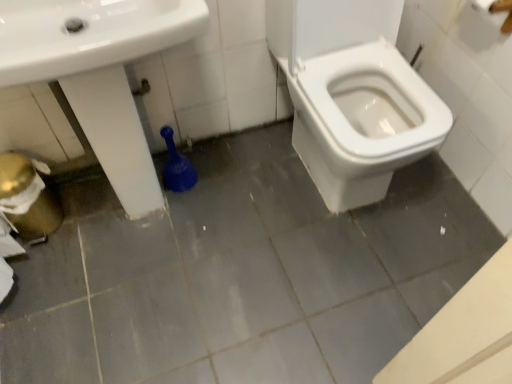
The image size is (512, 384). What do you see at coordinates (99, 73) in the screenshot?
I see `white glossy sink at lower left` at bounding box center [99, 73].

You are a GUI agent. You are given a task and a screenshot of the screen. Output one action in this format:
    pyautogui.click(x=<x>, y=<y>)
    Task: Click on the white glossy sink at lower left
    The width and height of the screenshot is (512, 384).
    Given the screenshot: What is the action you would take?
    pyautogui.click(x=99, y=73)

In order to face white glossy toilet at center, should I rotate leftwards or rightwards?

A 14.107 degree turn to the right will do.

What do you see at coordinates (352, 95) in the screenshot? I see `white glossy toilet at center` at bounding box center [352, 95].

You are a GUI agent. You are given a task and a screenshot of the screen. Output one action in this format:
    pyautogui.click(x=<x>, y=<y>)
    Task: Click on the white glossy toilet at center
    The width and height of the screenshot is (512, 384).
    Given the screenshot: What is the action you would take?
    click(x=352, y=95)

Locate an element on the screen. white glossy sink at lower left is located at coordinates (99, 73).

Which is more to the right, white glossy toilet at center or white glossy sink at lower left?

Positioned to the right is white glossy toilet at center.

In the scene shown: Considering the positions of objects white glossy toilet at center and white glossy sink at lower left in the image provided, who is behind, white glossy toilet at center or white glossy sink at lower left?

white glossy toilet at center is further from the camera.

Which point is more distant from viewer, (433, 129) or (150, 179)?

The point (150, 179) is farther from the camera.

From the image's perspective, which is above, white glossy toilet at center or white glossy sink at lower left?

From the image's view, white glossy toilet at center is above.

From a real-world perspective, is white glossy toilet at center physically located above or below white glossy sink at lower left?

From a real-world perspective, white glossy toilet at center is physically below white glossy sink at lower left.

Considering the relative sizes of white glossy toilet at center and white glossy sink at lower left in the image provided, is white glossy toilet at center wider than white glossy sink at lower left?

Yes, white glossy toilet at center is wider than white glossy sink at lower left.

Can you confirm if white glossy toilet at center is shorter than white glossy sink at lower left?

Yes, white glossy toilet at center is shorter than white glossy sink at lower left.

Looking at the image, does white glossy toilet at center seem bigger or smaller compared to white glossy sink at lower left?

Clearly, white glossy toilet at center is smaller in size than white glossy sink at lower left.

Choose the correct answer: Is white glossy toilet at center inside white glossy sink at lower left or outside it?

white glossy toilet at center is located beyond the bounds of white glossy sink at lower left.

Is white glossy toilet at center placed right next to white glossy sink at lower left?

No, white glossy toilet at center is not making contact with white glossy sink at lower left.

Is white glossy toilet at center oriented away from white glossy sink at lower left?

white glossy toilet at center is not turned away from white glossy sink at lower left.

The width and height of the screenshot is (512, 384). I want to click on sink in front of the white glossy toilet at center, so click(99, 73).

In the scene shown: Considering the positions of objects white glossy sink at lower left and white glossy toilet at center in the image provided, who is more to the left, white glossy sink at lower left or white glossy toilet at center?

white glossy sink at lower left is more to the left.

Which object is closer to the camera taking this photo, white glossy sink at lower left or white glossy toilet at center?

white glossy sink at lower left.

Does point (26, 42) come farther from viewer compared to point (316, 44)?

No, (26, 42) is in front of (316, 44).

From the image's perspective, is white glossy sink at lower left above or below white glossy toilet at center?

From the image's perspective, white glossy sink at lower left appears below white glossy toilet at center.

In the scene shown: From a real-world perspective, is white glossy sink at lower left positioned under white glossy toilet at center based on gravity?

Incorrect, from a real-world perspective, white glossy sink at lower left is higher than white glossy toilet at center.

In the scene shown: Does white glossy sink at lower left have a greater width compared to white glossy toilet at center?

No, white glossy sink at lower left is not wider than white glossy toilet at center.

Which of these two, white glossy sink at lower left or white glossy toilet at center, stands shorter?

With less height is white glossy toilet at center.

Considering the sizes of objects white glossy sink at lower left and white glossy toilet at center in the image provided, who is smaller, white glossy sink at lower left or white glossy toilet at center?

white glossy toilet at center is smaller.

Would you say white glossy toilet at center is part of white glossy sink at lower left's contents?

No, white glossy toilet at center is located outside of white glossy sink at lower left.

Looking at this image, is white glossy sink at lower left directly adjacent to white glossy toilet at center?

No, white glossy sink at lower left is not in contact with white glossy toilet at center.

Is white glossy sink at lower left oriented away from white glossy toilet at center?

white glossy sink at lower left does not have its back to white glossy toilet at center.

Can you tell me how much white glossy sink at lower left and white glossy toilet at center differ in facing direction?

They differ by 1.31 degrees in their facing directions.

The image size is (512, 384). What are the coordinates of `sink lying below the white glossy toilet at center (from the image's perspective)` in the screenshot? It's located at (99, 73).

I want to click on toilet above the white glossy sink at lower left (from the image's perspective), so click(352, 95).

This screenshot has width=512, height=384. Find the location of `sink above the white glossy toilet at center (from a real-world perspective)`. sink above the white glossy toilet at center (from a real-world perspective) is located at coordinates (99, 73).